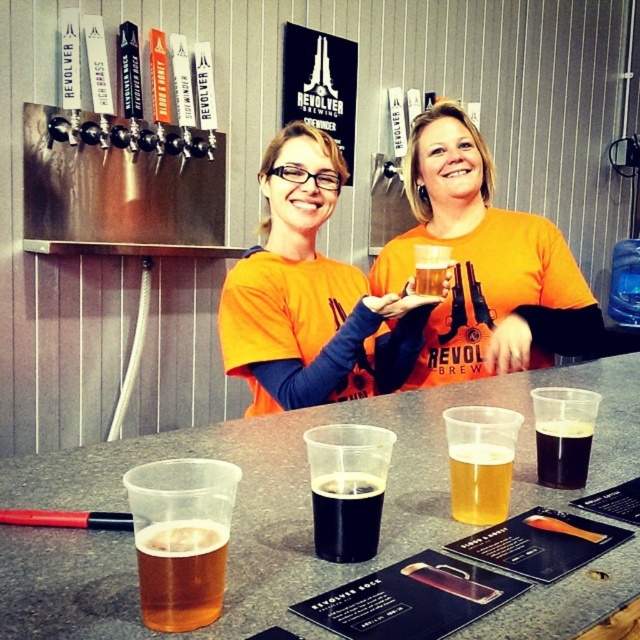
Question: Where is golden amber liquid at center located in relation to black matte beer at center in the image?

Choices:
 (A) left
 (B) right

Answer: (A)

Question: Which object appears farthest from the camera in this image?

Choices:
 (A) orange t-shirt at center
 (B) golden amber liquid at center
 (C) orange cotton shirt at center
 (D) black matte glass at center

Answer: (C)

Question: Which object is farther from the camera taking this photo?

Choices:
 (A) orange cotton shirt at center
 (B) golden matte beer at lower left
 (C) golden amber liquid at center

Answer: (A)

Question: Can you confirm if orange t-shirt at center is positioned above golden amber liquid at center?

Choices:
 (A) no
 (B) yes

Answer: (B)

Question: Among these points, which one is farthest from the camera?

Choices:
 (A) (422, 365)
 (B) (376, 481)
 (C) (173, 548)

Answer: (A)

Question: Is golden amber liquid at center further to camera compared to translucent plastic cup at center?

Choices:
 (A) no
 (B) yes

Answer: (A)